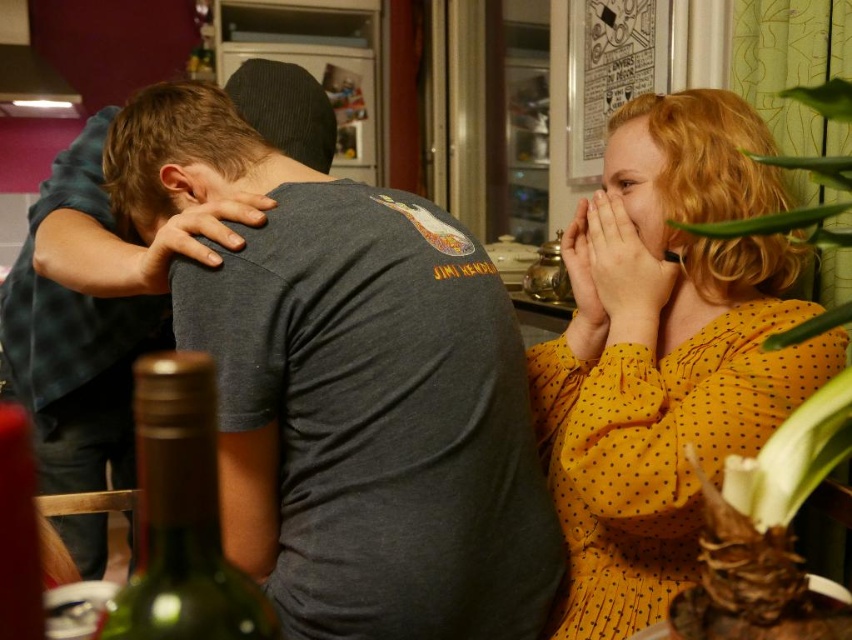
Is yellow dotted blouse at right behind green glass bottle at lower left?

That is True.

Who is positioned more to the right, yellow dotted blouse at right or green glass bottle at lower left?

Positioned to the right is yellow dotted blouse at right.

At what (x,y) coordinates should I click in order to perform the action: click on yellow dotted blouse at right. Please return your answer as a coordinate pair (x, y). This screenshot has height=640, width=852. Looking at the image, I should click on (665, 349).

You are a GUI agent. You are given a task and a screenshot of the screen. Output one action in this format:
    pyautogui.click(x=<x>, y=<y>)
    Task: Click on the yellow dotted blouse at right
    The image size is (852, 640).
    Given the screenshot: What is the action you would take?
    pyautogui.click(x=665, y=349)

Who is higher up, dark gray t-shirt at left or green glass bottle at lower left?

dark gray t-shirt at left is above.

Which is more to the right, dark gray t-shirt at left or green glass bottle at lower left?

green glass bottle at lower left is more to the right.

At what (x,y) coordinates should I click in order to perform the action: click on dark gray t-shirt at left. Please return your answer as a coordinate pair (x, y). Looking at the image, I should click on (91, 314).

Does yellow dotted blouse at right have a lesser height compared to dark gray t-shirt at left?

Yes, yellow dotted blouse at right is shorter than dark gray t-shirt at left.

Is yellow dotted blouse at right taller than dark gray t-shirt at left?

No, yellow dotted blouse at right is not taller than dark gray t-shirt at left.

Which is in front, point (591, 609) or point (90, 454)?

Point (591, 609) is in front.

Where is `yellow dotted blouse at right`? This screenshot has height=640, width=852. yellow dotted blouse at right is located at coordinates pyautogui.click(x=665, y=349).